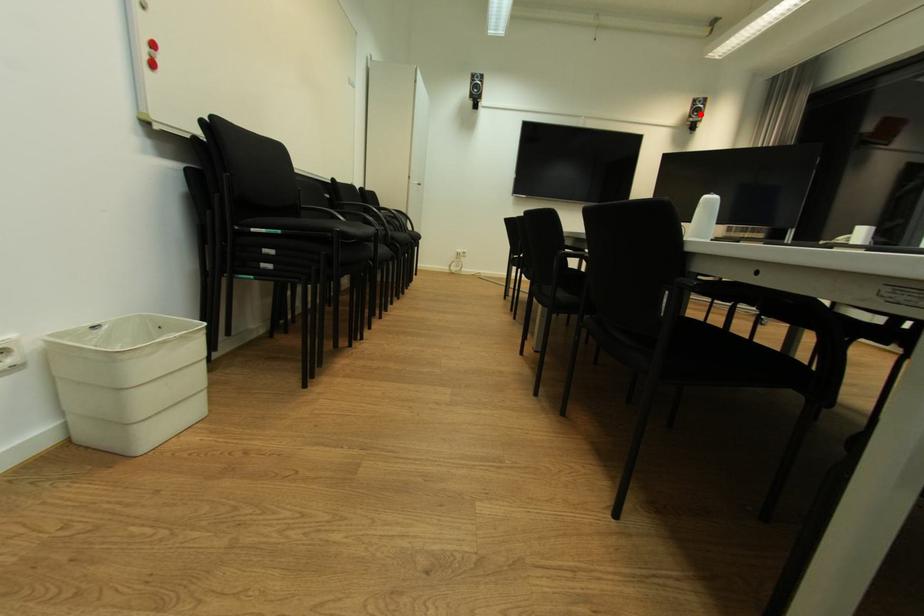
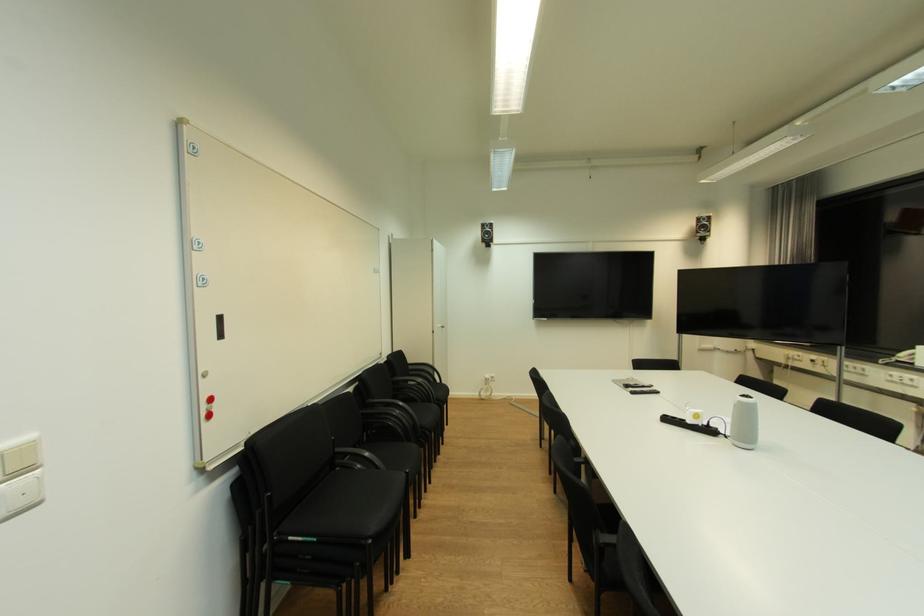
In the second image, find the point that corresponds to the highlighted location in the first image.

(708, 231)